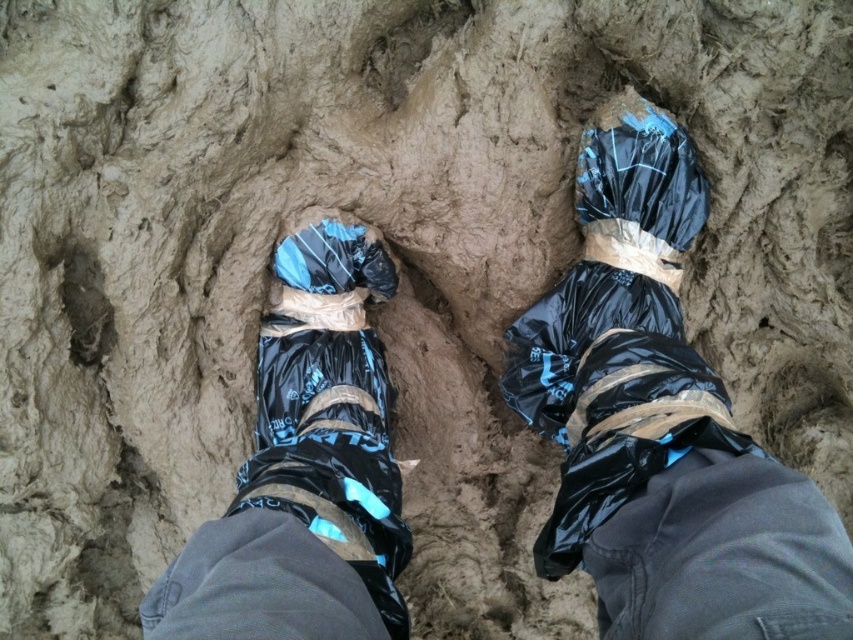
Which is behind, point (573, 349) or point (602, 429)?

The point (573, 349) is more distant.

Which is below, black plastic boots at center or black plastic bag at center?

Positioned lower is black plastic bag at center.

Which is in front, point (645, 570) or point (578, 500)?

Point (645, 570) is more forward.

The width and height of the screenshot is (853, 640). Find the location of `black plastic boots at center`. black plastic boots at center is located at coordinates (662, 424).